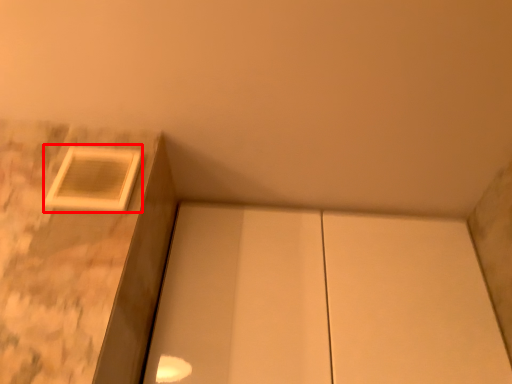
Question: From the image's perspective, where is window (annotated by the red box) located in relation to cabinetry in the image?

Choices:
 (A) below
 (B) above

Answer: (B)